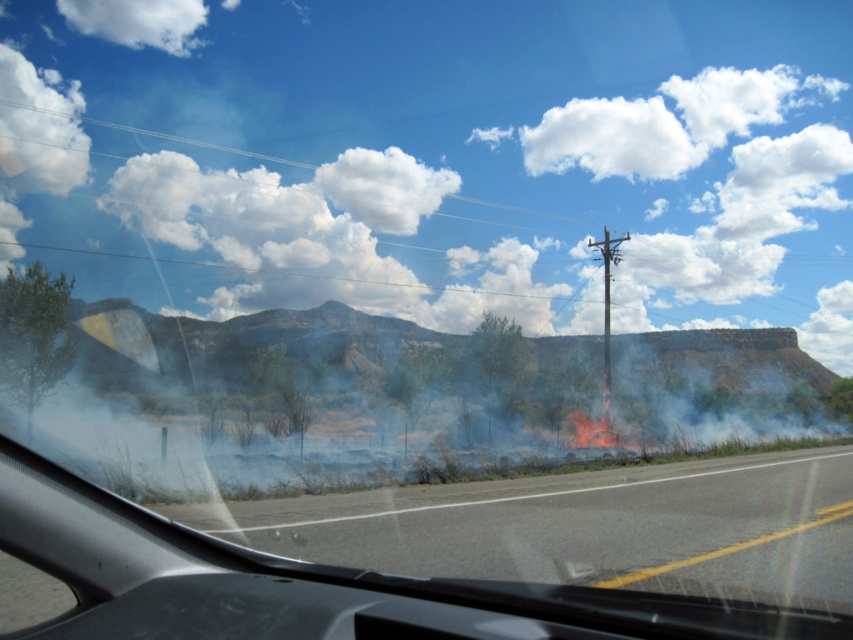
You are a GPS navigator and need to inform the driver about the location of the smooth asphalt highway at center. What are its coordinates?

The smooth asphalt highway at center is located at coordinates point (589, 528).

You are a passenger in the car and want to point out two specific points in the scene. The first point is at coordinates point [753,532] and the second is at point [605,330]. Which of these two points is closer to you?

Point [753,532] is closer to the camera than point [605,330], so the first point is closer to you.